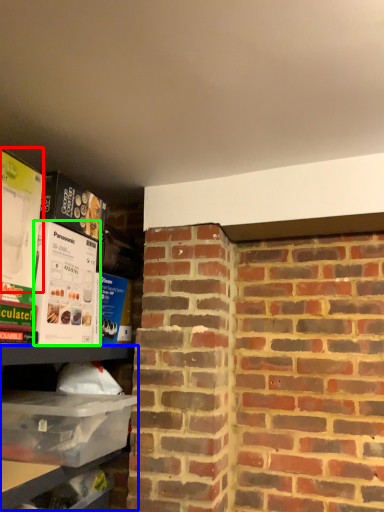
Question: Estimate the real-world distances between objects in this image. Which object is farther from box (highlighted by a red box), shelf (highlighted by a blue box) or box (highlighted by a green box)?

Choices:
 (A) shelf
 (B) box

Answer: (A)